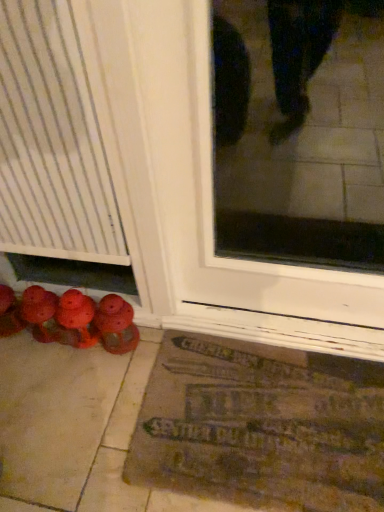
You are a GUI agent. You are given a task and a screenshot of the screen. Output one action in this format:
    pyautogui.click(x=<x>, y=<y>)
    Task: Click on the free space to the left of matte red shoes at lower left, positioned as the first footwear in right-to-left order
    This screenshot has height=512, width=384.
    Given the screenshot: What is the action you would take?
    pyautogui.click(x=56, y=373)